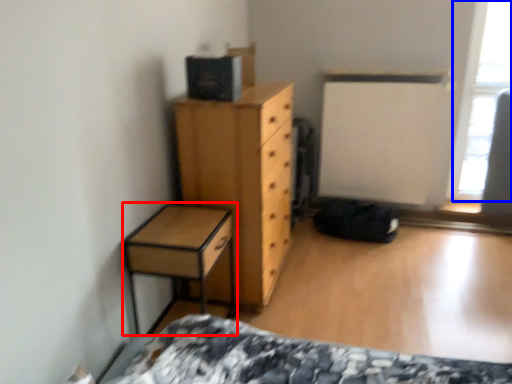
Question: Which of the following is the farthest to the observer, nightstand (highlighted by a red box) or window screen (highlighted by a blue box)?

Choices:
 (A) nightstand
 (B) window screen

Answer: (B)